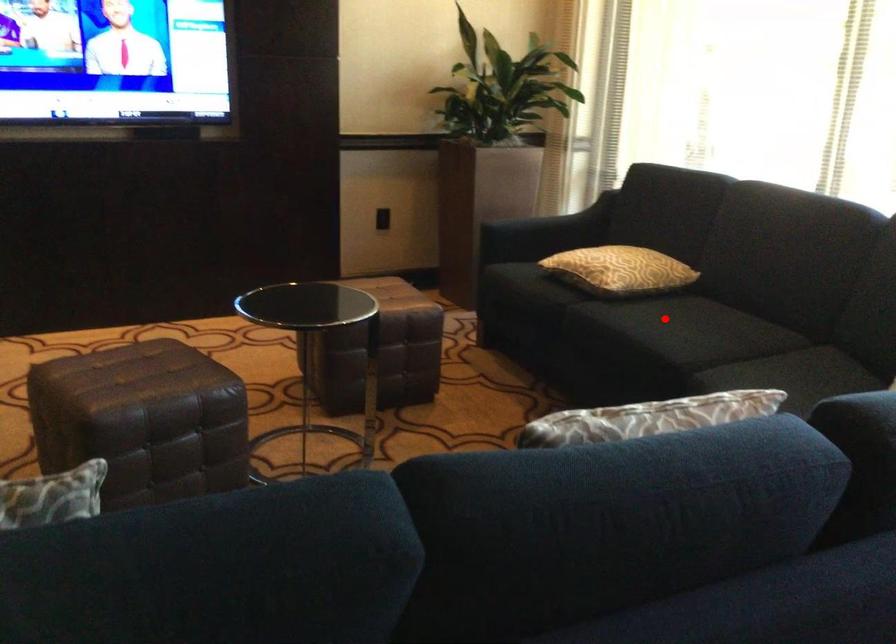
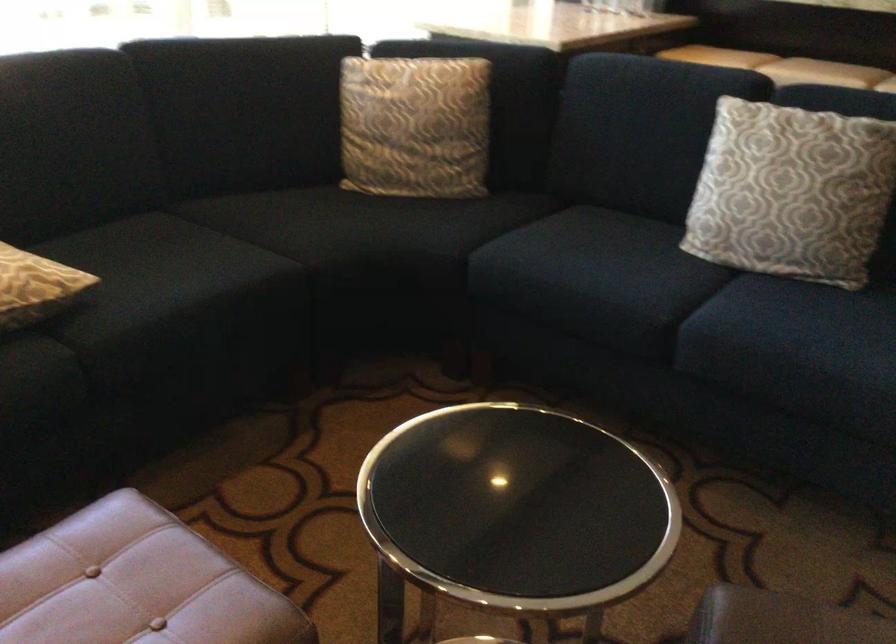
The point at the highlighted location is marked in the first image. Where is the corresponding point in the second image?

(161, 270)